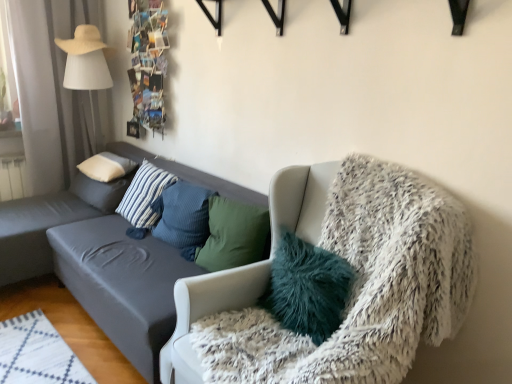
Question: From a real-world perspective, is blue textured pillow at center, the second pillow when ordered from right to left, on top of dark gray fabric couch at left?

Choices:
 (A) yes
 (B) no

Answer: (A)

Question: Does blue textured pillow at center, which appears as the fourth pillow when viewed from the left, have a smaller size compared to dark gray fabric couch at left?

Choices:
 (A) no
 (B) yes

Answer: (B)

Question: Considering the relative sizes of blue textured pillow at center, the second pillow when ordered from right to left, and dark gray fabric couch at left in the image provided, is blue textured pillow at center, the second pillow when ordered from right to left, thinner than dark gray fabric couch at left?

Choices:
 (A) no
 (B) yes

Answer: (B)

Question: Is blue textured pillow at center, which appears as the fourth pillow when viewed from the left, further to camera compared to dark gray fabric couch at left?

Choices:
 (A) yes
 (B) no

Answer: (A)

Question: Is blue textured pillow at center, which appears as the fourth pillow when viewed from the left, positioned in front of dark gray fabric couch at left?

Choices:
 (A) yes
 (B) no

Answer: (B)

Question: From the image's perspective, is white fabric lampshade at left located above or below white soft pillow at upper left, the 1th pillow when ordered from left to right?

Choices:
 (A) above
 (B) below

Answer: (A)

Question: In terms of height, does white fabric lampshade at left look taller or shorter compared to white soft pillow at upper left, arranged as the fifth pillow when viewed from the right?

Choices:
 (A) tall
 (B) short

Answer: (A)

Question: Would you say white fabric lampshade at left is to the left or to the right of white soft pillow at upper left, the 1th pillow when ordered from left to right, in the picture?

Choices:
 (A) right
 (B) left

Answer: (B)

Question: Choose the correct answer: Is white fabric lampshade at left inside white soft pillow at upper left, the 1th pillow when ordered from left to right, or outside it?

Choices:
 (A) outside
 (B) inside

Answer: (A)

Question: Considering the positions of point (89, 62) and point (175, 329), is point (89, 62) closer or farther from the camera than point (175, 329)?

Choices:
 (A) farther
 (B) closer

Answer: (A)

Question: Considering the positions of white fabric lampshade at left and white fluffy chair at right in the image, is white fabric lampshade at left taller or shorter than white fluffy chair at right?

Choices:
 (A) short
 (B) tall

Answer: (B)

Question: From a real-world perspective, relative to white fluffy chair at right, is white fabric lampshade at left vertically above or below?

Choices:
 (A) above
 (B) below

Answer: (A)

Question: Looking at their shapes, would you say white fabric lampshade at left is wider or thinner than white fluffy chair at right?

Choices:
 (A) thin
 (B) wide

Answer: (A)

Question: From their relative heights in the image, would you say blue textured pillow at center, the second pillow when ordered from right to left, is taller or shorter than white soft pillow at upper left, arranged as the fifth pillow when viewed from the right?

Choices:
 (A) tall
 (B) short

Answer: (A)

Question: From the image's perspective, is blue textured pillow at center, which appears as the fourth pillow when viewed from the left, located above or below white soft pillow at upper left, the 1th pillow when ordered from left to right?

Choices:
 (A) above
 (B) below

Answer: (B)